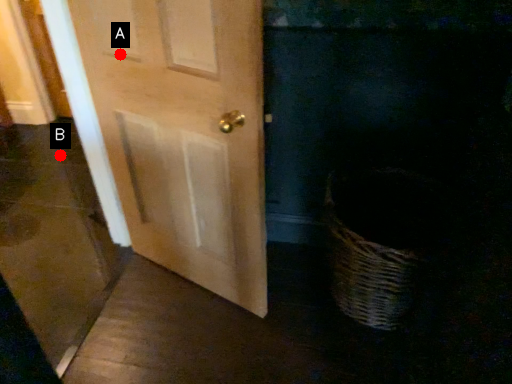
Question: Two points are circled on the image, labeled by A and B beside each circle. Which point is closer to the camera taking this photo?

Choices:
 (A) A is closer
 (B) B is closer

Answer: (A)